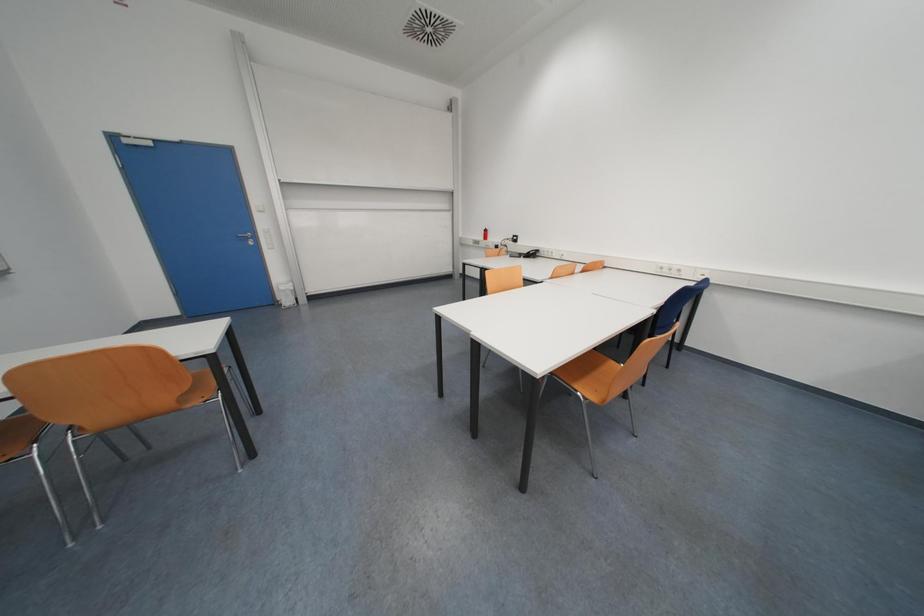
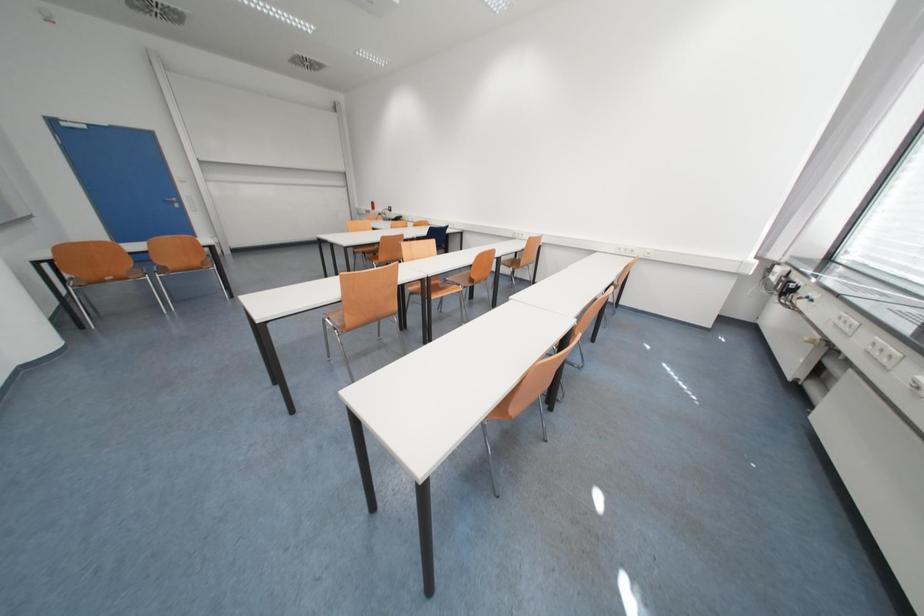
Which direction would the cameraman need to move to produce the second image?

The cameraman moved toward right, backward.